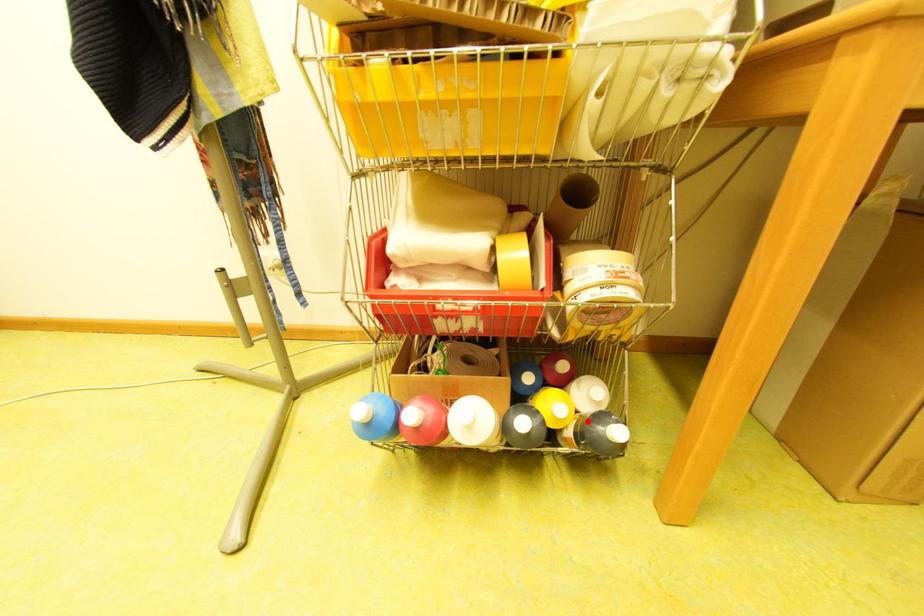
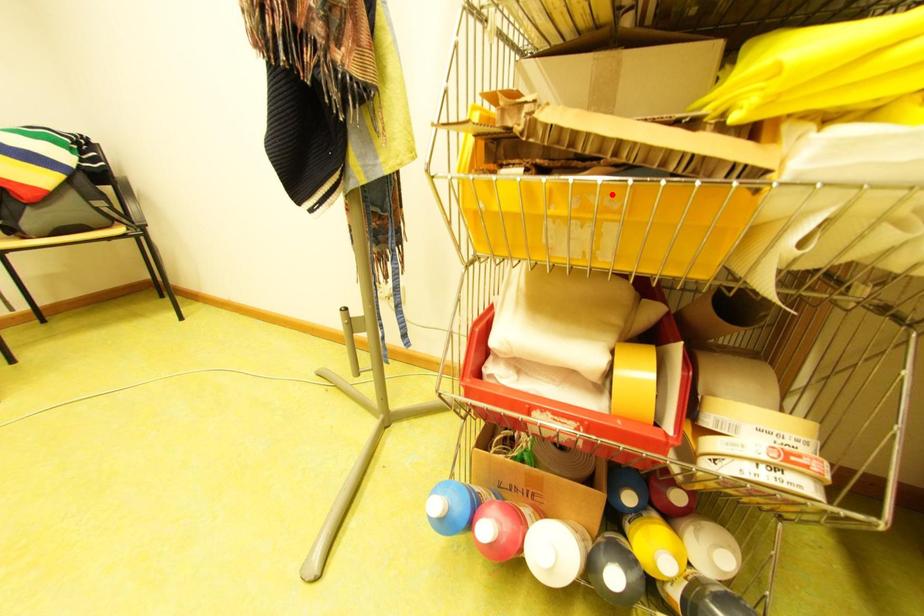
I am providing you with two images of the same scene from different viewpoints. A red point is marked on the first image and another point is marked on the second image. Is the marked point in image1 the same physical position as the marked point in image2?

No